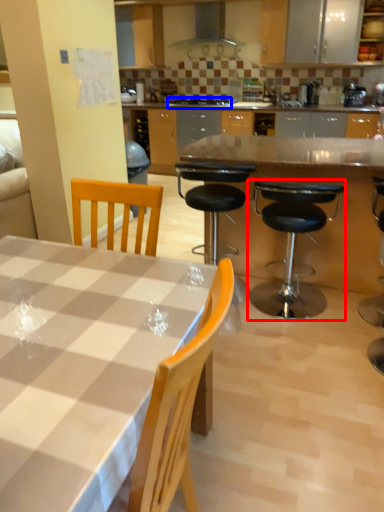
Question: Which object appears farthest to the camera in this image, chair (highlighted by a red box) or gas stove (highlighted by a blue box)?

Choices:
 (A) chair
 (B) gas stove

Answer: (B)